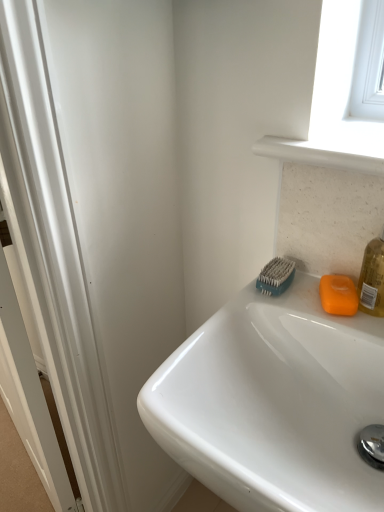
Describe the element at coordinates (276, 276) in the screenshot. I see `teal rubber brush at upper right` at that location.

Based on the photo, measure the distance between point (157,401) and camera.

Point (157,401) and camera are 51.20 centimeters apart.

This screenshot has height=512, width=384. What are the coordinates of `teal rubber brush at upper right` in the screenshot? It's located at tap(276, 276).

Which is closer to the camera, (265, 267) or (327, 448)?

Point (265, 267) is farther from the camera than point (327, 448).

Measure the distance between teal rubber brush at upper right and white glossy sink at upper right.

They are 7.29 inches apart.

Is teal rubber brush at upper right facing towards white glossy sink at upper right?

No, teal rubber brush at upper right does not turn towards white glossy sink at upper right.

Locate an element on the screen. The height and width of the screenshot is (512, 384). brush behind the white glossy sink at upper right is located at coordinates (276, 276).

Is point (223, 327) closer or farther from the camera than point (258, 283)?

Point (223, 327) appears to be closer to the viewer than point (258, 283).

From the image's perspective, is white glossy sink at upper right over teal rubber brush at upper right?

Incorrect, from the image's perspective, white glossy sink at upper right is lower than teal rubber brush at upper right.

Is white glossy sink at upper right to the right of teal rubber brush at upper right from the viewer's perspective?

Yes, white glossy sink at upper right is to the right of teal rubber brush at upper right.

Between white glossy sink at upper right and teal rubber brush at upper right, which one has smaller width?

teal rubber brush at upper right is thinner.

The image size is (384, 512). I want to click on brush above the orange matte soap at right (from the image's perspective), so click(276, 276).

Looking at this image, is orange matte soap at right not inside teal rubber brush at upper right?

Yes.

What's the angular difference between orange matte soap at right and teal rubber brush at upper right's facing directions?

orange matte soap at right and teal rubber brush at upper right are facing 19.4 degrees away from each other.

Is the depth of orange matte soap at right greater than that of teal rubber brush at upper right?

No, it is in front of teal rubber brush at upper right.

From the image's perspective, does teal rubber brush at upper right appear higher than orange matte soap at right?

Correct, teal rubber brush at upper right appears higher than orange matte soap at right in the image.

Considering the points (283, 259) and (341, 284), which point is behind, point (283, 259) or point (341, 284)?

Point (283, 259)

Are teal rubber brush at upper right and orange matte soap at right beside each other?

Indeed, teal rubber brush at upper right and orange matte soap at right are beside each other and touching.

Is teal rubber brush at upper right inside the boundaries of orange matte soap at right, or outside?

teal rubber brush at upper right cannot be found inside orange matte soap at right.

Are orange matte soap at right and white glossy sink at upper right located far from each other?

No, orange matte soap at right is in close proximity to white glossy sink at upper right.

Which object is closer to the camera taking this photo, orange matte soap at right or white glossy sink at upper right?

white glossy sink at upper right is closer to the camera.

Looking at this image, considering the relative positions of orange matte soap at right and white glossy sink at upper right in the image provided, is orange matte soap at right to the left of white glossy sink at upper right from the viewer's perspective?

Incorrect, orange matte soap at right is not on the left side of white glossy sink at upper right.

From a real-world perspective, is orange matte soap at right physically below white glossy sink at upper right?

No, from a real-world perspective, orange matte soap at right is not beneath white glossy sink at upper right.

Which of these two, white glossy sink at upper right or orange matte soap at right, stands shorter?

orange matte soap at right.

From a real-world perspective, is white glossy sink at upper right on orange matte soap at right?

No, from a real-world perspective, white glossy sink at upper right is not above orange matte soap at right.

Is white glossy sink at upper right directly adjacent to orange matte soap at right?

No, white glossy sink at upper right is not beside orange matte soap at right.

Between white glossy sink at upper right and orange matte soap at right, which one appears on the right side from the viewer's perspective?

orange matte soap at right is more to the right.

Locate an element on the screen. Image resolution: width=384 pixels, height=512 pixels. sink that is on the right side of teal rubber brush at upper right is located at coordinates (274, 403).

Image resolution: width=384 pixels, height=512 pixels. I want to click on sink in front of the teal rubber brush at upper right, so (x=274, y=403).

Estimate the real-world distances between objects in this image. Which object is further from teal rubber brush at upper right, white glossy sink at upper right or orange matte soap at right?

Based on the image, white glossy sink at upper right appears to be further to teal rubber brush at upper right.

Which object lies nearer to the anchor point teal rubber brush at upper right, orange matte soap at right or white glossy sink at upper right?

Based on the image, orange matte soap at right appears to be nearer to teal rubber brush at upper right.

Considering their positions, is orange matte soap at right positioned further to white glossy sink at upper right than teal rubber brush at upper right?

Among the two, teal rubber brush at upper right is located further to white glossy sink at upper right.

When comparing their distances from orange matte soap at right, does teal rubber brush at upper right or white glossy sink at upper right seem further?

The object further to orange matte soap at right is white glossy sink at upper right.

From the image, which object appears to be farther from white glossy sink at upper right, teal rubber brush at upper right or orange matte soap at right?

The object further to white glossy sink at upper right is teal rubber brush at upper right.

Estimate the real-world distances between objects in this image. Which object is closer to orange matte soap at right, white glossy sink at upper right or teal rubber brush at upper right?

Based on the image, teal rubber brush at upper right appears to be nearer to orange matte soap at right.

The height and width of the screenshot is (512, 384). Identify the location of soap between teal rubber brush at upper right and white glossy sink at upper right in the up-down direction. (338, 295).